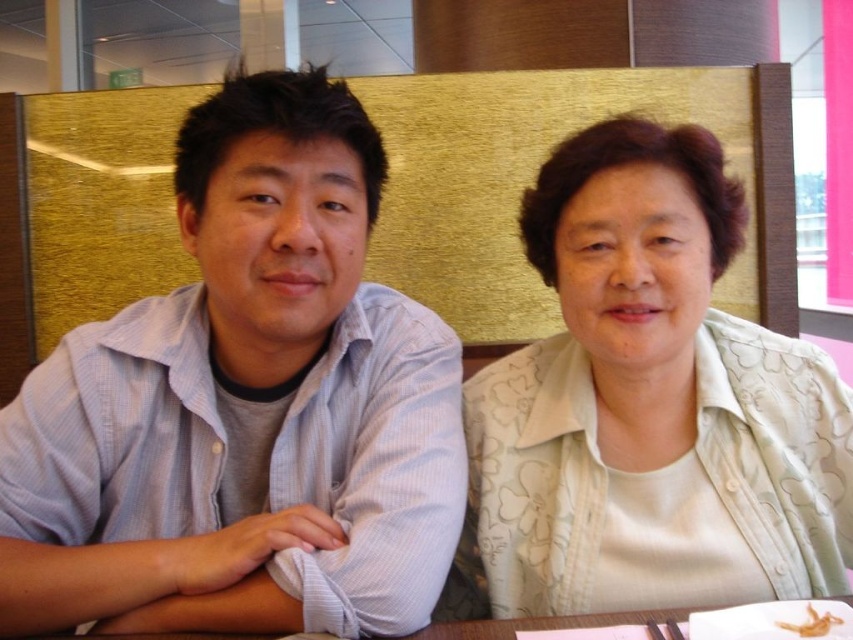
Is light blue striped shirt at left positioned in front of light green floral blouse at center?

Yes, light blue striped shirt at left is in front of light green floral blouse at center.

Is light blue striped shirt at left wider than light green floral blouse at center?

Yes.

At what (x,y) coordinates should I click in order to perform the action: click on light blue striped shirt at left. Please return your answer as a coordinate pair (x, y). This screenshot has height=640, width=853. Looking at the image, I should click on (244, 406).

Does light blue striped shirt at left appear on the left side of translucent yellow shrimp at lower right?

Indeed, light blue striped shirt at left is positioned on the left side of translucent yellow shrimp at lower right.

Is light blue striped shirt at left further to the viewer compared to translucent yellow shrimp at lower right?

Yes, light blue striped shirt at left is further from the viewer.

Where is `light blue striped shirt at left`? The width and height of the screenshot is (853, 640). light blue striped shirt at left is located at coordinates (244, 406).

Is point (589, 244) less distant than point (828, 616)?

That is False.

Based on the photo, does light green floral blouse at center have a lesser width compared to translucent yellow shrimp at lower right?

In fact, light green floral blouse at center might be wider than translucent yellow shrimp at lower right.

Find the location of a particular element. The width and height of the screenshot is (853, 640). light green floral blouse at center is located at coordinates (648, 404).

Find the location of `light green floral blouse at center`. light green floral blouse at center is located at coordinates (648, 404).